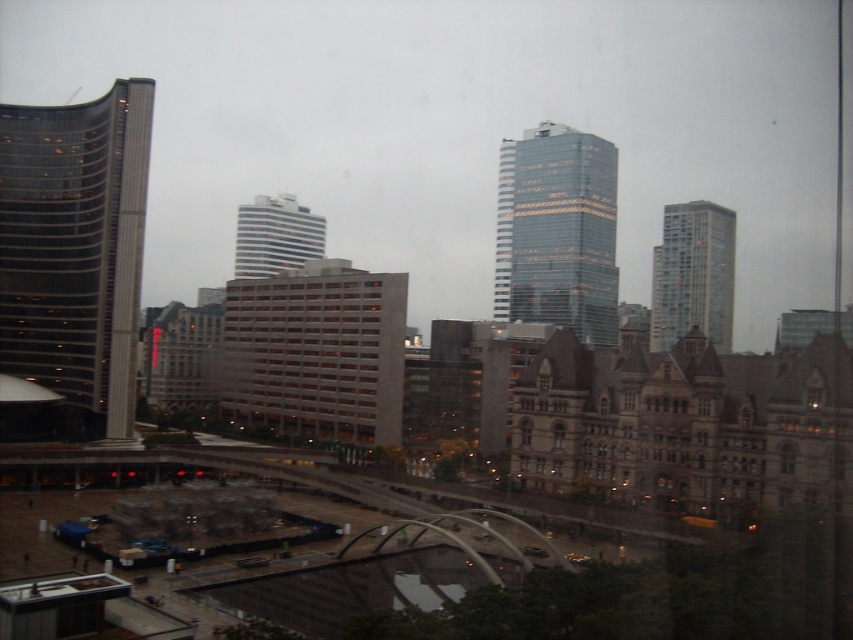
Does point (24, 192) come behind point (653, 292)?

That is False.

Which is below, glassy reflective skyscraper at left or glassy reflective tower at right?

glassy reflective tower at right is below.

Find the location of `glassy reflective skyscraper at left`. glassy reflective skyscraper at left is located at coordinates (74, 244).

Can you confirm if glassy reflective skyscraper at left is positioned above brown brick building at center?

Indeed, glassy reflective skyscraper at left is positioned over brown brick building at center.

Can you confirm if glassy reflective skyscraper at left is shorter than brown brick building at center?

No.

Which is in front, point (25, 259) or point (273, 376)?

Point (25, 259) is in front.

At what (x,y) coordinates should I click in order to perform the action: click on glassy reflective skyscraper at left. Please return your answer as a coordinate pair (x, y). Looking at the image, I should click on click(74, 244).

The width and height of the screenshot is (853, 640). Describe the element at coordinates (315, 353) in the screenshot. I see `brown brick building at center` at that location.

Between brown brick building at center and glassy reflective tower at right, which one is positioned higher?

Positioned higher is glassy reflective tower at right.

You are a GUI agent. You are given a task and a screenshot of the screen. Output one action in this format:
    pyautogui.click(x=<x>, y=<y>)
    Task: Click on the brown brick building at center
    
    Given the screenshot: What is the action you would take?
    pyautogui.click(x=315, y=353)